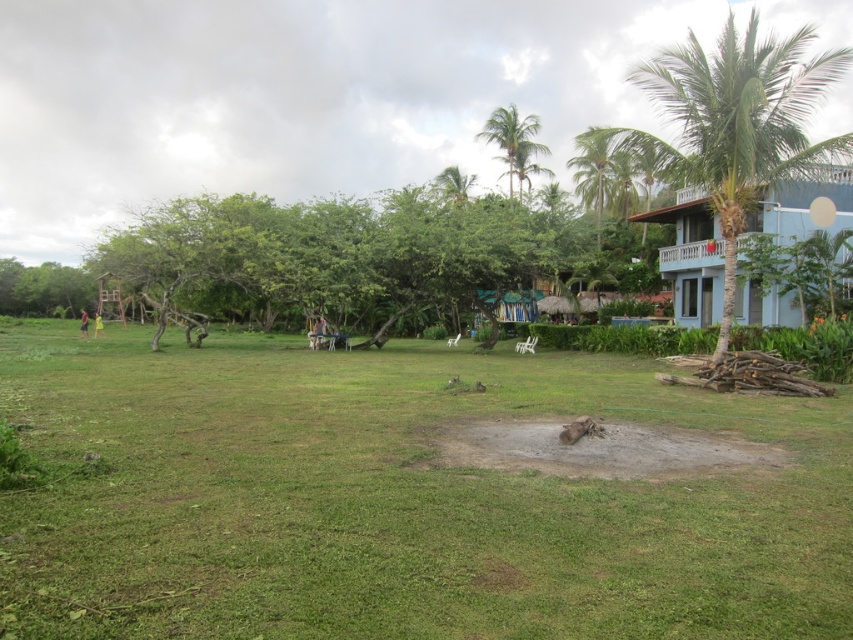
You are standing in the middle of the lawn and want to walk towards the two points marked in the image. Which point, point [83,310] or point [96,337], will you reach first?

Point [83,310] is closer to you than point [96,337], so you will reach point [83,310] first.

You are a gardener standing on the green grass at center. You want to water the green fabric person at lower left. Can you reach them with your hose without moving?

The green fabric person at lower left is above the green grass at center, so you can reach them with your hose while staying on the green grass at center.

Looking at this image, you are standing at the camera position and want to walk towards the green grass at lower left. How far will you have to walk to reach it?

The green grass at lower left is 124.81 feet away from the camera, so you will have to walk 124.81 feet to reach it.